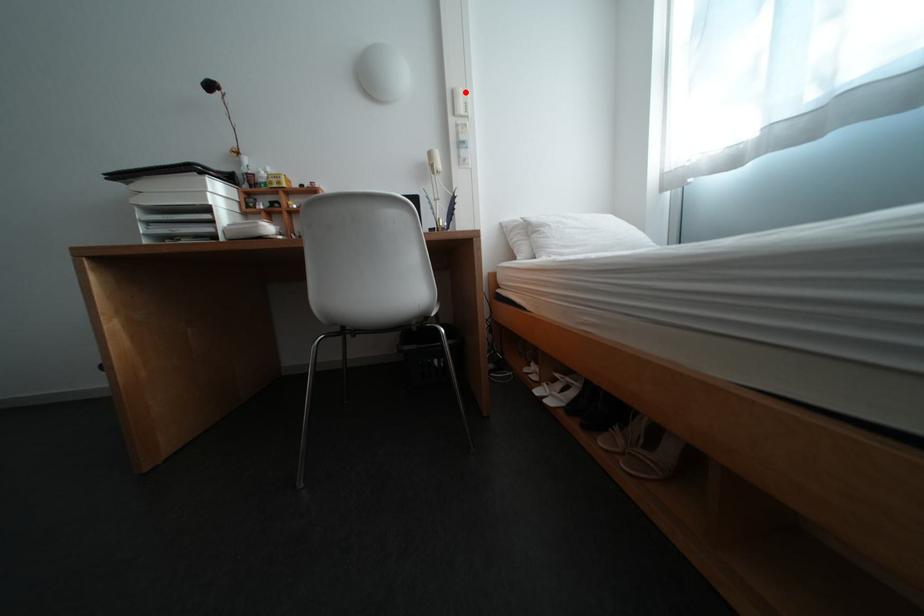
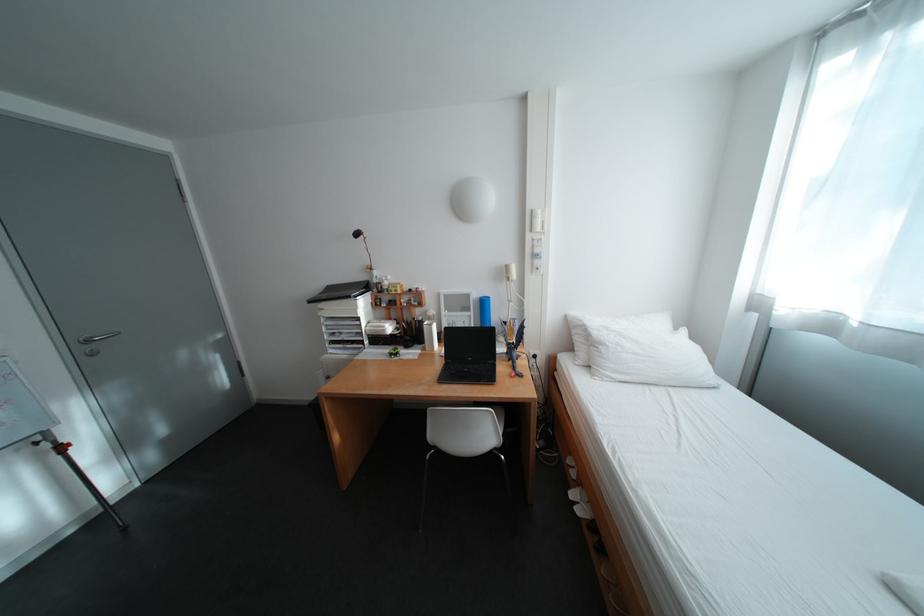
Find the pixel in the second image that matches the highlighted location in the first image.

(544, 213)